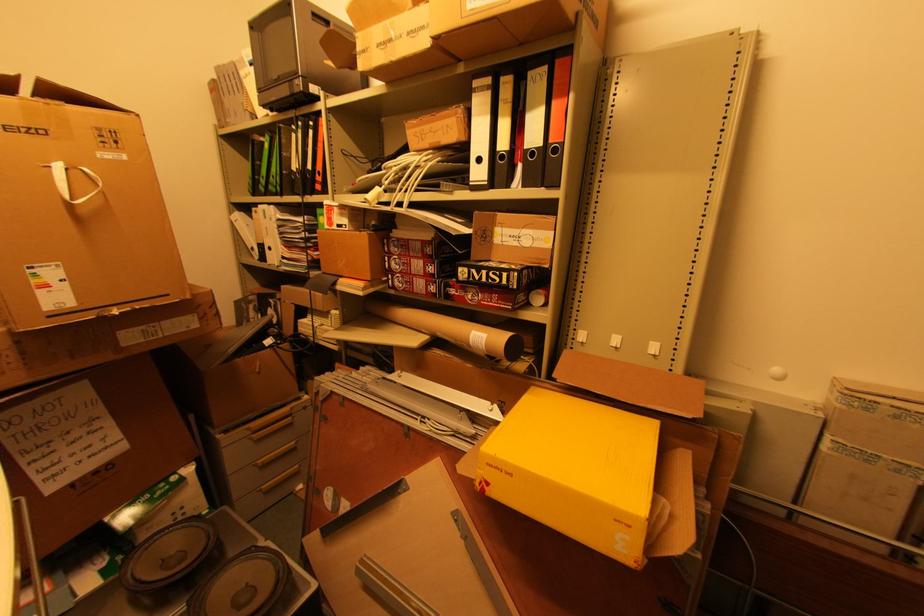
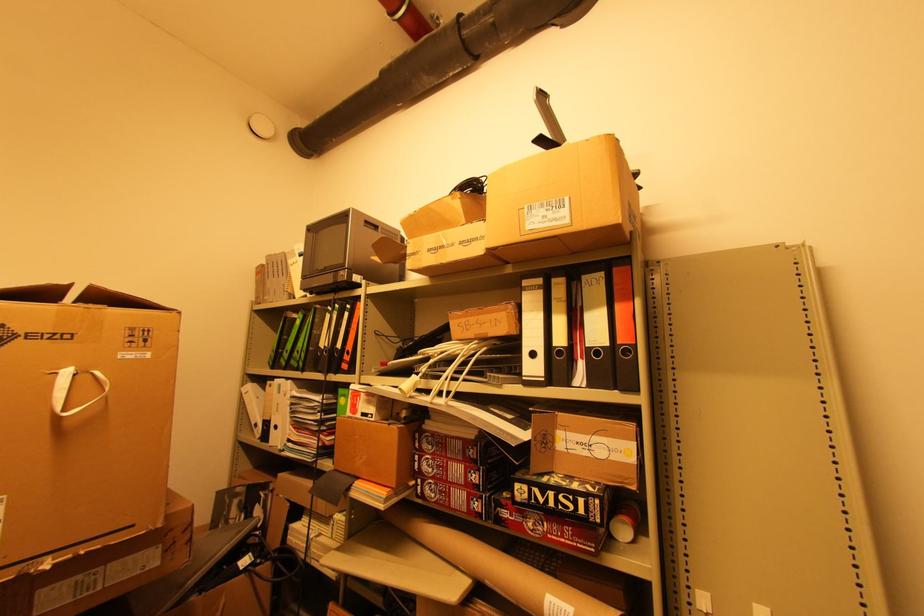
Find the pixel in the second image that matches (314,92) in the first image.

(358, 281)